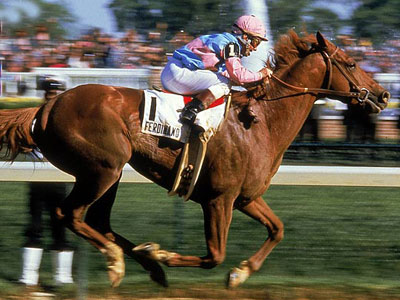
Locate an element on the screen. This screenshot has height=300, width=400. stands is located at coordinates (132, 77).